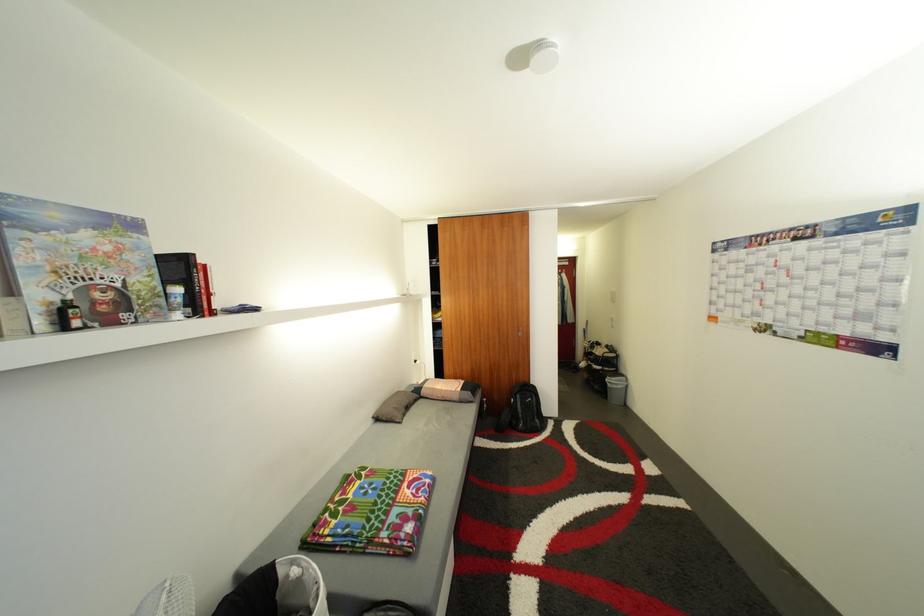
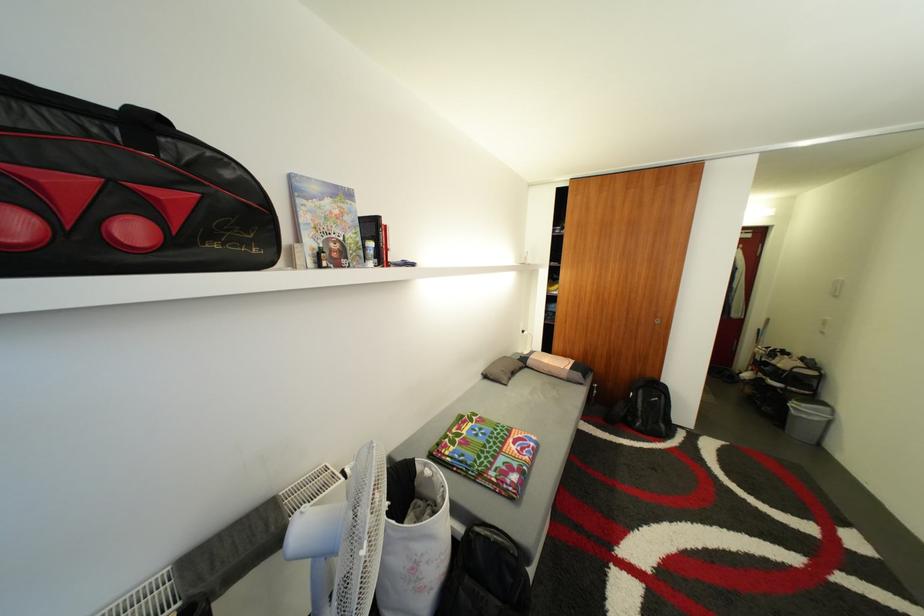
Question: The images are taken continuously from a first-person perspective. In which direction are you moving?

Choices:
 (A) Left
 (B) Right
 (C) Forward
 (D) Backward

Answer: (A)